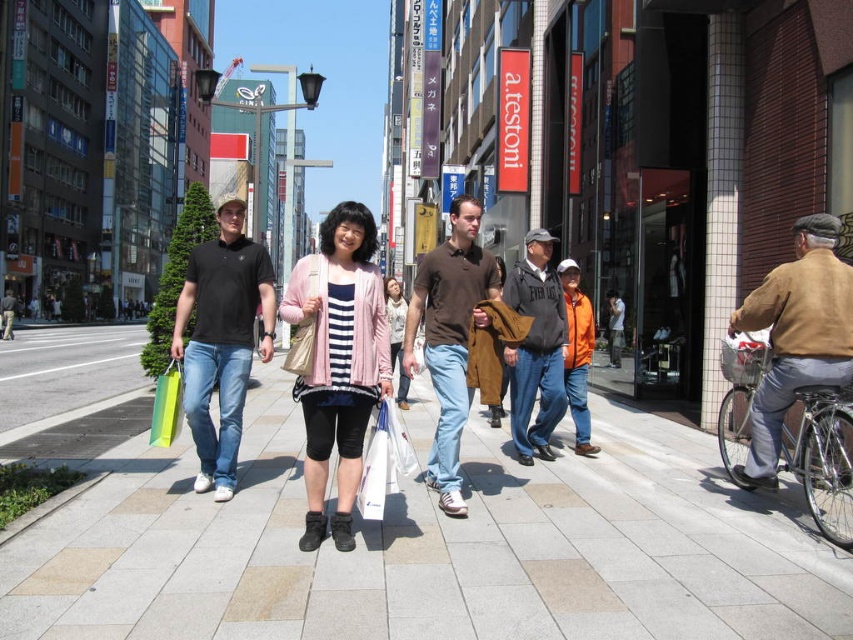
Which is below, matte black polo shirt at left or brown leather jacket at right?

brown leather jacket at right

Between point (229, 257) and point (759, 298), which one is positioned in front?

Point (759, 298) is in front.

Is point (198, 394) closer to viewer compared to point (786, 301)?

No, (198, 394) is further to viewer.

You are a GUI agent. You are given a task and a screenshot of the screen. Output one action in this format:
    pyautogui.click(x=<x>, y=<y>)
    Task: Click on the matte black polo shirt at left
    This screenshot has height=640, width=853.
    Given the screenshot: What is the action you would take?
    pyautogui.click(x=222, y=340)

In the scene shown: Between pink fabric jacket at center and matte black polo shirt at left, which one appears on the left side from the viewer's perspective?

matte black polo shirt at left is more to the left.

Looking at this image, which of these two, pink fabric jacket at center or matte black polo shirt at left, stands shorter?

Standing shorter between the two is pink fabric jacket at center.

Measure the distance between point (381,339) and camera.

Point (381,339) and camera are 4.36 meters apart.

Where is `pink fabric jacket at center`? The height and width of the screenshot is (640, 853). pink fabric jacket at center is located at coordinates (338, 362).

Who is positioned more to the right, brown leather jacket at right or brown leather jacket at center?

From the viewer's perspective, brown leather jacket at right appears more on the right side.

Does brown leather jacket at right have a lesser width compared to brown leather jacket at center?

Correct, brown leather jacket at right's width is less than brown leather jacket at center's.

What are the coordinates of `brown leather jacket at right` in the screenshot? It's located at (796, 337).

Identify the location of brown leather jacket at right. (796, 337).